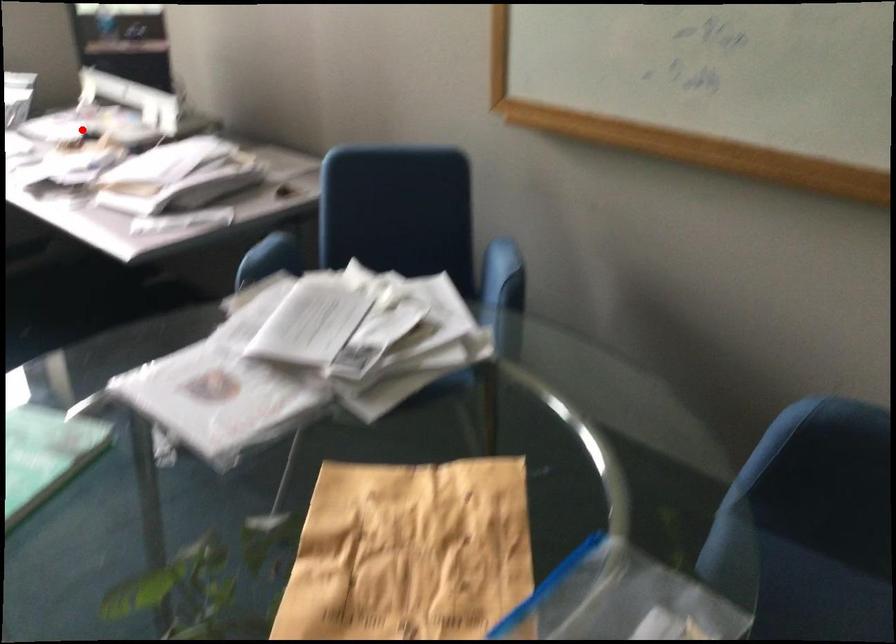
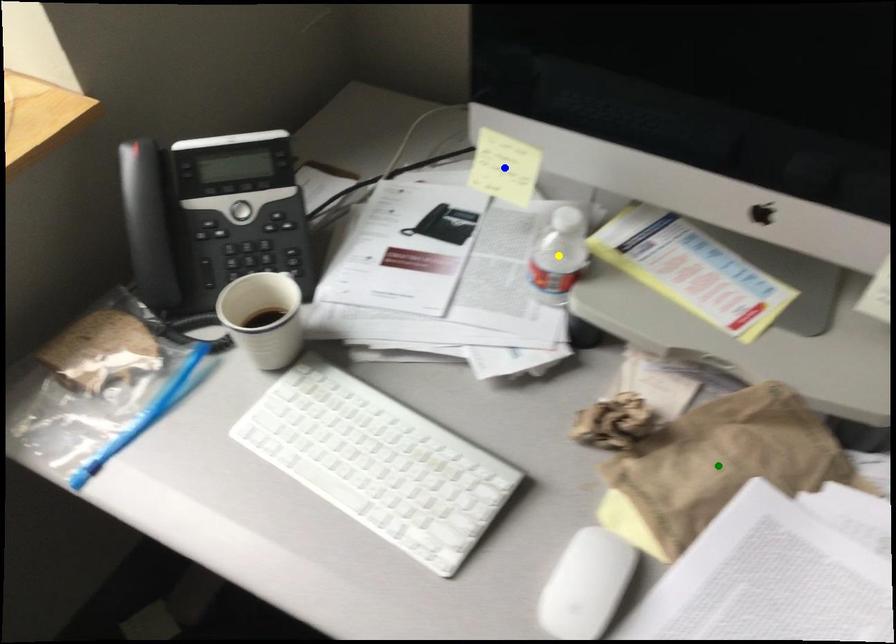
Question: I am providing you with two images of the same scene from different viewpoints. A red point is marked on the first image. You are given multiple points on the second image. Which mark in image 2 goes with the point in image 1?

Choices:
 (A) yellow point
 (B) green point
 (C) blue point

Answer: (B)